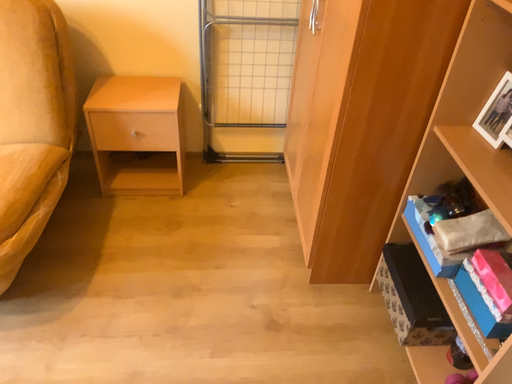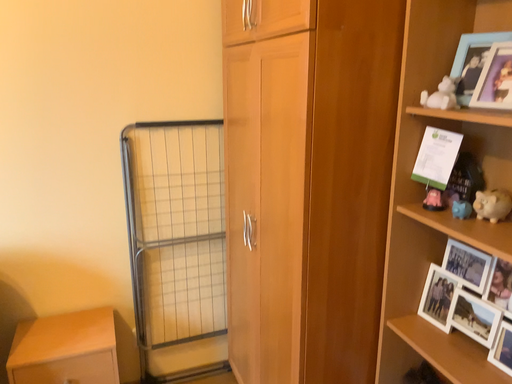
Question: How did the camera likely rotate when shooting the video?

Choices:
 (A) rotated upward
 (B) rotated downward

Answer: (A)